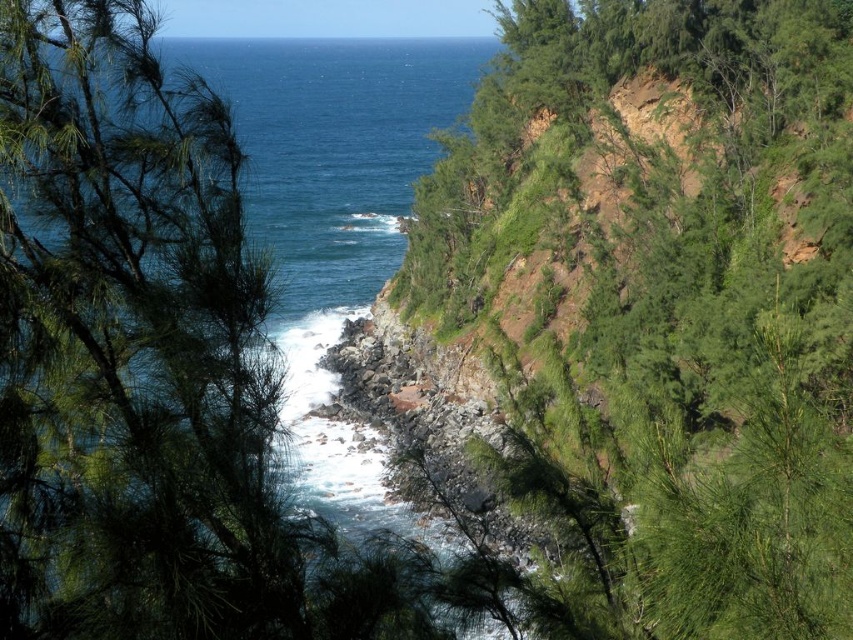
Who is more distant from viewer, (775, 298) or (308, 284)?

Positioned behind is point (308, 284).

Who is more distant from viewer, (849,84) or (399,68)?

Positioned behind is point (399,68).

The width and height of the screenshot is (853, 640). I want to click on green leafy tree at upper right, so click(x=670, y=308).